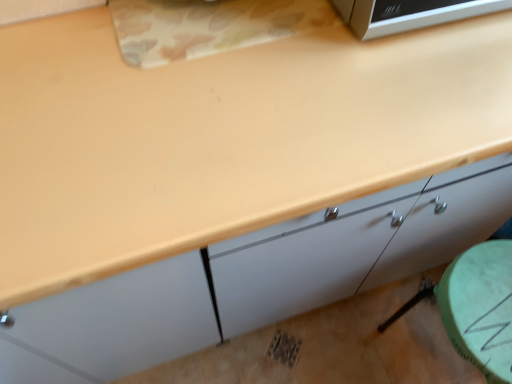
What do you see at coordinates (253, 279) in the screenshot?
I see `white glossy cabinet at center` at bounding box center [253, 279].

I want to click on white glossy cabinet at center, so pos(253,279).

You are a GUI agent. You are given a task and a screenshot of the screen. Output one action in this format:
    pyautogui.click(x=<x>, y=<y>)
    Task: Click on the white glossy cabinet at center
    This screenshot has height=384, width=512.
    Given the screenshot: What is the action you would take?
    pyautogui.click(x=253, y=279)